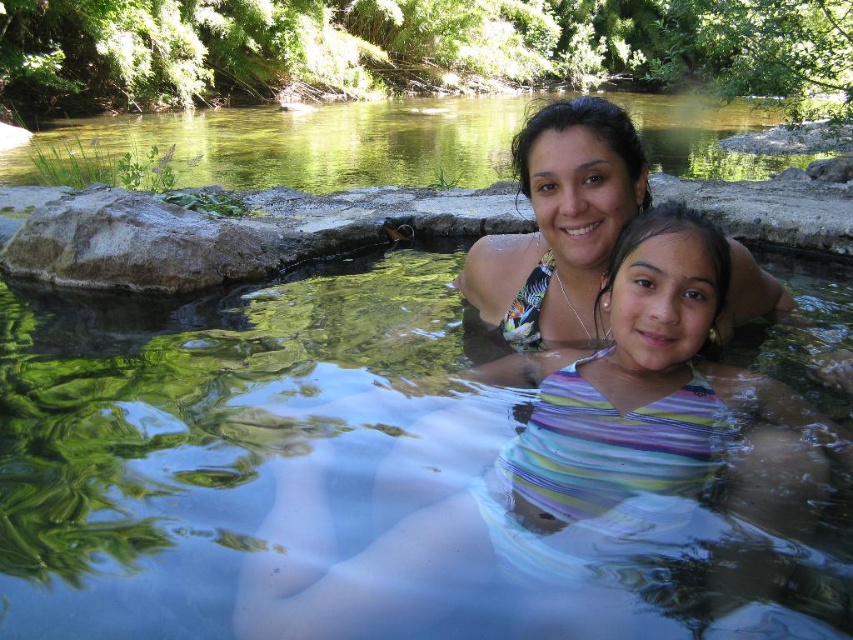
What do you see at coordinates (306, 144) in the screenshot? I see `clear water at upper center` at bounding box center [306, 144].

Is clear water at upper center further to the viewer compared to multicolored bikini top at center?

Yes.

You are a GUI agent. You are given a task and a screenshot of the screen. Output one action in this format:
    pyautogui.click(x=<x>, y=<y>)
    Task: Click on the clear water at upper center
    The height and width of the screenshot is (640, 853).
    Given the screenshot: What is the action you would take?
    pyautogui.click(x=306, y=144)

Find the location of a particular element. clear water at upper center is located at coordinates (306, 144).

Can you confirm if striped fabric swimsuit at center is bigger than clear water at upper center?

Actually, striped fabric swimsuit at center might be smaller than clear water at upper center.

Is striped fabric swimsuit at center closer to camera compared to clear water at upper center?

Yes, striped fabric swimsuit at center is in front of clear water at upper center.

Which is behind, point (299, 582) or point (685, 164)?

The point (685, 164) is behind.

This screenshot has width=853, height=640. I want to click on striped fabric swimsuit at center, so click(x=569, y=460).

Between point (555, 412) and point (519, 180), which one is positioned in front?

Point (555, 412)

Looking at this image, is striped fabric swimsuit at center shorter than multicolored bikini top at center?

Yes, striped fabric swimsuit at center is shorter than multicolored bikini top at center.

In order to click on striped fabric swimsuit at center in this screenshot , I will do `click(569, 460)`.

The width and height of the screenshot is (853, 640). What are the coordinates of `striped fabric swimsuit at center` in the screenshot? It's located at (569, 460).